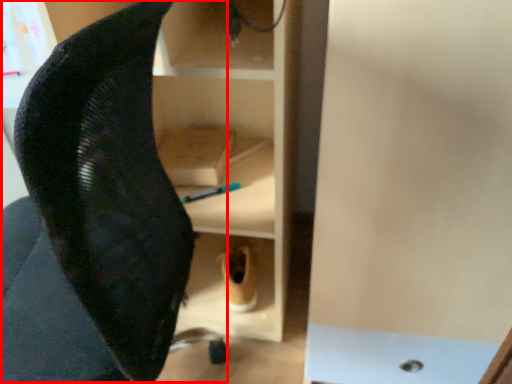
Question: From the image's perspective, what is the correct spatial positioning of swivel chair (annotated by the red box) in reference to footwear?

Choices:
 (A) below
 (B) above

Answer: (B)